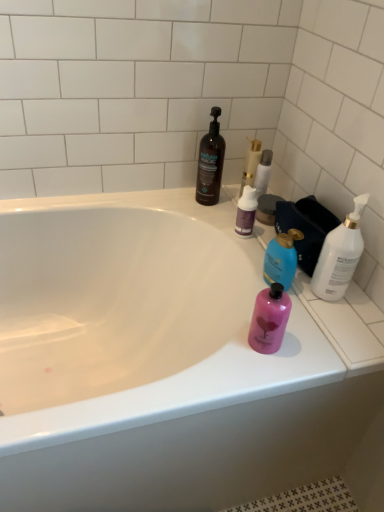
The height and width of the screenshot is (512, 384). What are the coordinates of `free point in front of pink matte bottle at right, positioned as the third bottle in right-to-left order` in the screenshot? It's located at (251, 373).